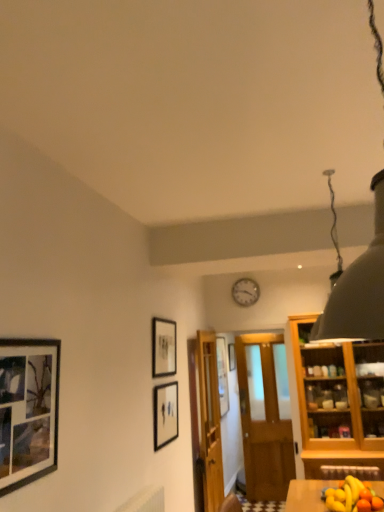
The image size is (384, 512). Describe the element at coordinates (264, 420) in the screenshot. I see `wooden door at center, the second door in the left-to-right sequence` at that location.

This screenshot has height=512, width=384. What are the coordinates of `matte black picture frame at center, which ranks as the 2th picture frame in front-to-back order` in the screenshot? It's located at (165, 414).

What is the approximate width of wooden door at center, marked as the 1th door in a left-to-right arrangement?

The width of wooden door at center, marked as the 1th door in a left-to-right arrangement, is 5.69 inches.

Identify the location of matte black picture frame at left, which ranks as the 1th picture frame in left-to-right order. The image size is (384, 512). (28, 410).

How much space does matte black picture frame at left, which is the fifth picture frame in right-to-left order, occupy vertically?

22.34 inches.

Find the location of a particular element. The width and height of the screenshot is (384, 512). metallic clock at upper center, the second picture frame when ordered from back to front is located at coordinates (245, 292).

Identify the location of wooden table at lower right. [307, 495].

Does black matte picture frame at upper center, the second picture frame when ordered from right to left, lie behind wooden door at center, the 1th door when ordered from right to left?

Yes, black matte picture frame at upper center, the second picture frame when ordered from right to left, is behind wooden door at center, the 1th door when ordered from right to left.

Is black matte picture frame at upper center, placed as the 1th picture frame when sorted from back to front, taller or shorter than wooden door at center, the second door in the left-to-right sequence?

black matte picture frame at upper center, placed as the 1th picture frame when sorted from back to front, is shorter than wooden door at center, the second door in the left-to-right sequence.

From the image's perspective, relative to wooden door at center, the second door in the left-to-right sequence, is black matte picture frame at upper center, placed as the 1th picture frame when sorted from back to front, above or below?

black matte picture frame at upper center, placed as the 1th picture frame when sorted from back to front, is above wooden door at center, the second door in the left-to-right sequence.

From a real-world perspective, is black matte picture frame at upper center, the second picture frame when ordered from right to left, positioned under wooden door at center, the second door in the left-to-right sequence, based on gravity?

Actually, black matte picture frame at upper center, the second picture frame when ordered from right to left, is physically above wooden door at center, the second door in the left-to-right sequence, in the real world.

Is white matte lampshade at upper right next to wooden table at lower right and touching it?

No, white matte lampshade at upper right is not in contact with wooden table at lower right.

Locate an element on the screen. The height and width of the screenshot is (512, 384). light fixture that is in front of the wooden table at lower right is located at coordinates (359, 288).

Which is behind, white matte lampshade at upper right or wooden table at lower right?

Positioned behind is wooden table at lower right.

How different are the orientations of white matte lampshade at upper right and wooden table at lower right in degrees?

The angular difference between white matte lampshade at upper right and wooden table at lower right is 2.97 degrees.

Consider the image. Is metallic clock at upper center, arranged as the first picture frame when viewed from the right, facing away from matte black picture frame at upper center, which appears as the 2th picture frame when viewed from the left?

That's not correct — metallic clock at upper center, arranged as the first picture frame when viewed from the right, is not looking away from matte black picture frame at upper center, which appears as the 2th picture frame when viewed from the left.

Would you say metallic clock at upper center, the second picture frame when ordered from back to front, is inside or outside matte black picture frame at upper center, which appears as the 2th picture frame when viewed from the left?

metallic clock at upper center, the second picture frame when ordered from back to front, exists outside the volume of matte black picture frame at upper center, which appears as the 2th picture frame when viewed from the left.

Is metallic clock at upper center, arranged as the first picture frame when viewed from the right, next to matte black picture frame at upper center, the 3th picture frame viewed from the front?

No, metallic clock at upper center, arranged as the first picture frame when viewed from the right, is not in contact with matte black picture frame at upper center, the 3th picture frame viewed from the front.

Which is more to the left, wooden door at center, the second door in the left-to-right sequence, or metallic clock at upper center, the fifth picture frame in the left-to-right sequence?

metallic clock at upper center, the fifth picture frame in the left-to-right sequence, is more to the left.

This screenshot has width=384, height=512. What are the coordinates of `the 1st picture frame to the left of the wooden door at center, the second door in the left-to-right sequence, starting your count from the anchor` in the screenshot? It's located at (245, 292).

From a real-world perspective, is metallic clock at upper center, the second picture frame when ordered from back to front, physically located above or below wooden door at center, the 1th door when ordered from right to left?

metallic clock at upper center, the second picture frame when ordered from back to front, is above wooden door at center, the 1th door when ordered from right to left.

Could you tell me if metallic clock at upper center, the second picture frame when ordered from back to front, is turned towards wooden door at center, the 1th door when ordered from right to left?

No, metallic clock at upper center, the second picture frame when ordered from back to front, is not oriented towards wooden door at center, the 1th door when ordered from right to left.

Is wooden door at center, the second door in the left-to-right sequence, completely or partially inside metallic clock at upper center, acting as the fourth picture frame starting from the front?

No, wooden door at center, the second door in the left-to-right sequence, is located outside of metallic clock at upper center, acting as the fourth picture frame starting from the front.

Could you measure the distance between metallic clock at upper center, acting as the fourth picture frame starting from the front, and wooden door at center, the 1th door when ordered from right to left?

The distance of metallic clock at upper center, acting as the fourth picture frame starting from the front, from wooden door at center, the 1th door when ordered from right to left, is 4.07 feet.

Which object is positioned more to the left, matte black picture frame at center, the 3th picture frame viewed from the left, or matte black picture frame at left, the fifth picture frame from the back?

Positioned to the left is matte black picture frame at left, the fifth picture frame from the back.

Is matte black picture frame at center, which ranks as the 2th picture frame in front-to-back order, next to matte black picture frame at left, which ranks as the 1th picture frame in left-to-right order, and touching it?

There is a gap between matte black picture frame at center, which ranks as the 2th picture frame in front-to-back order, and matte black picture frame at left, which ranks as the 1th picture frame in left-to-right order.

Between matte black picture frame at center, positioned as the 3th picture frame in right-to-left order, and matte black picture frame at left, which is the first picture frame in front-to-back order, which one has larger width?

matte black picture frame at left, which is the first picture frame in front-to-back order, is wider.

Based on the photo, from the image's perspective, is matte black picture frame at center, the 3th picture frame viewed from the left, over matte black picture frame at left, which is the fifth picture frame in right-to-left order?

No, from the image's perspective, matte black picture frame at center, the 3th picture frame viewed from the left, is not above matte black picture frame at left, which is the fifth picture frame in right-to-left order.

Is metallic clock at upper center, the second picture frame when ordered from back to front, to the left of matte black picture frame at left, which is the first picture frame in front-to-back order, from the viewer's perspective?

Incorrect, metallic clock at upper center, the second picture frame when ordered from back to front, is not on the left side of matte black picture frame at left, which is the first picture frame in front-to-back order.

Which is behind, point (252, 287) or point (0, 368)?

The point (252, 287) is farther from the camera.

Who is shorter, metallic clock at upper center, the second picture frame when ordered from back to front, or matte black picture frame at left, which is the first picture frame in front-to-back order?

metallic clock at upper center, the second picture frame when ordered from back to front, is shorter.

Is metallic clock at upper center, the second picture frame when ordered from back to front, outside of matte black picture frame at left, which is the first picture frame in front-to-back order?

Absolutely, metallic clock at upper center, the second picture frame when ordered from back to front, is external to matte black picture frame at left, which is the first picture frame in front-to-back order.

From the black matte picture frame at upper center, placed as the 1th picture frame when sorted from back to front, count 1st doors forward and point to it. Please provide its 2D coordinates.

[(264, 420)]

Locate an element on the screen. The width and height of the screenshot is (384, 512). table below the white matte lampshade at upper right (from a real-world perspective) is located at coordinates (307, 495).

Which object lies nearer to the anchor point matte black picture frame at center, the 3th picture frame viewed from the left, wooden door at center, the 1th door when ordered from right to left, or wooden table at lower right?

Based on the image, wooden table at lower right appears to be nearer to matte black picture frame at center, the 3th picture frame viewed from the left.

From the picture: Which object lies further to the anchor point matte black picture frame at left, which is the fifth picture frame in right-to-left order, matte black picture frame at upper center, the 4th picture frame when ordered from right to left, or metallic clock at upper center, the fifth picture frame in the left-to-right sequence?

Among the two, metallic clock at upper center, the fifth picture frame in the left-to-right sequence, is located further to matte black picture frame at left, which is the fifth picture frame in right-to-left order.

Estimate the real-world distances between objects in this image. Which object is further from matte black picture frame at center, which ranks as the 2th picture frame in front-to-back order, matte black picture frame at upper center, which is the 3th picture frame in back-to-front order, or wooden door at center, the 1th door when ordered from right to left?

wooden door at center, the 1th door when ordered from right to left, is further to matte black picture frame at center, which ranks as the 2th picture frame in front-to-back order.

When comparing their distances from wooden door at center, marked as the 1th door in a left-to-right arrangement, does wooden table at lower right or metallic clock at upper center, the fifth picture frame in the left-to-right sequence, seem closer?

The object closer to wooden door at center, marked as the 1th door in a left-to-right arrangement, is metallic clock at upper center, the fifth picture frame in the left-to-right sequence.

Which object lies nearer to the anchor point wooden table at lower right, black matte picture frame at upper center, arranged as the 4th picture frame when viewed from the left, or metallic clock at upper center, the fifth picture frame in the left-to-right sequence?

metallic clock at upper center, the fifth picture frame in the left-to-right sequence, is closer to wooden table at lower right.

Based on their spatial positions, is metallic clock at upper center, arranged as the first picture frame when viewed from the right, or wooden door at center, the 1th door when ordered from right to left, closer to black matte picture frame at upper center, acting as the fifth picture frame starting from the front?

wooden door at center, the 1th door when ordered from right to left, is positioned closer to the anchor black matte picture frame at upper center, acting as the fifth picture frame starting from the front.

Which object lies further to the anchor point wooden table at lower right, matte black picture frame at upper center, the 4th picture frame when ordered from right to left, or matte black picture frame at left, the fifth picture frame from the back?

matte black picture frame at left, the fifth picture frame from the back.

Based on their spatial positions, is wooden table at lower right or white matte lampshade at upper right further from matte black picture frame at left, which ranks as the 1th picture frame in left-to-right order?

wooden table at lower right lies further to matte black picture frame at left, which ranks as the 1th picture frame in left-to-right order, than the other object.

This screenshot has width=384, height=512. Identify the location of picture frame between matte black picture frame at upper center, which is the 3th picture frame in back-to-front order, and black matte picture frame at upper center, the second picture frame when ordered from right to left, in the front-back direction. (245, 292).

Where is `picture frame between wooden door at center, marked as the 1th door in a left-to-right arrangement, and black matte picture frame at upper center, arranged as the 4th picture frame when viewed from the left, from front to back`? picture frame between wooden door at center, marked as the 1th door in a left-to-right arrangement, and black matte picture frame at upper center, arranged as the 4th picture frame when viewed from the left, from front to back is located at coordinates (245, 292).

Locate an element on the screen. door positioned between matte black picture frame at left, which ranks as the 1th picture frame in left-to-right order, and wooden door at center, the second door in the left-to-right sequence, from near to far is located at coordinates (209, 422).

You are a GUI agent. You are given a task and a screenshot of the screen. Output one action in this format:
    pyautogui.click(x=<x>, y=<y>)
    Task: Click on the picture frame positioned between white matte lampshade at upper right and wooden table at lower right from near to far
    
    Given the screenshot: What is the action you would take?
    pyautogui.click(x=28, y=410)